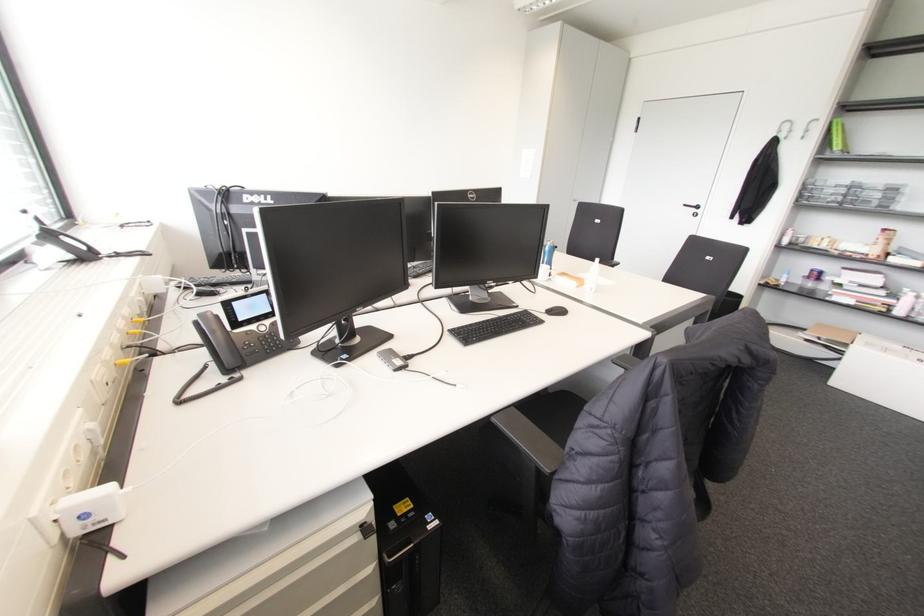
The width and height of the screenshot is (924, 616). What are the coordinates of `black chair armrest` in the screenshot? It's located at (529, 438).